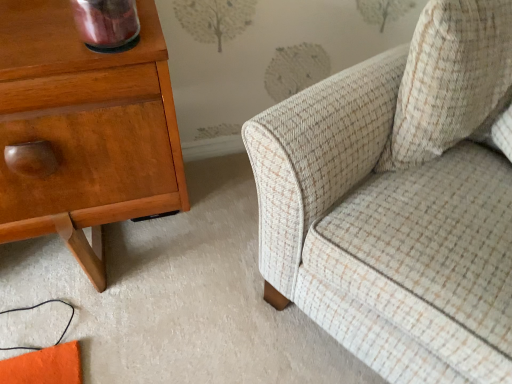
Question: Does beige textured cushion at upper right appear on the left side of shiny wood nightstand at left?

Choices:
 (A) no
 (B) yes

Answer: (A)

Question: Does beige textured cushion at upper right have a lesser width compared to shiny wood nightstand at left?

Choices:
 (A) no
 (B) yes

Answer: (B)

Question: Is beige textured cushion at upper right wider than shiny wood nightstand at left?

Choices:
 (A) yes
 (B) no

Answer: (B)

Question: Considering the relative sizes of beige textured cushion at upper right and shiny wood nightstand at left in the image provided, is beige textured cushion at upper right smaller than shiny wood nightstand at left?

Choices:
 (A) yes
 (B) no

Answer: (A)

Question: Is beige textured cushion at upper right positioned behind shiny wood nightstand at left?

Choices:
 (A) yes
 (B) no

Answer: (A)

Question: Considering the relative sizes of beige textured cushion at upper right and shiny wood nightstand at left in the image provided, is beige textured cushion at upper right bigger than shiny wood nightstand at left?

Choices:
 (A) no
 (B) yes

Answer: (A)

Question: Is beige tweed sofa at right facing away from shiny wood nightstand at left?

Choices:
 (A) no
 (B) yes

Answer: (A)

Question: Is beige tweed sofa at right located outside shiny wood nightstand at left?

Choices:
 (A) no
 (B) yes

Answer: (B)

Question: Is the position of beige tweed sofa at right more distant than that of shiny wood nightstand at left?

Choices:
 (A) no
 (B) yes

Answer: (A)

Question: From a real-world perspective, is beige tweed sofa at right physically below shiny wood nightstand at left?

Choices:
 (A) no
 (B) yes

Answer: (A)

Question: Can you confirm if beige tweed sofa at right is wider than shiny wood nightstand at left?

Choices:
 (A) no
 (B) yes

Answer: (B)

Question: From the image's perspective, is beige tweed sofa at right beneath shiny wood nightstand at left?

Choices:
 (A) no
 (B) yes

Answer: (A)

Question: Can you confirm if shiny wood nightstand at left is wider than beige textured cushion at upper right?

Choices:
 (A) no
 (B) yes

Answer: (B)